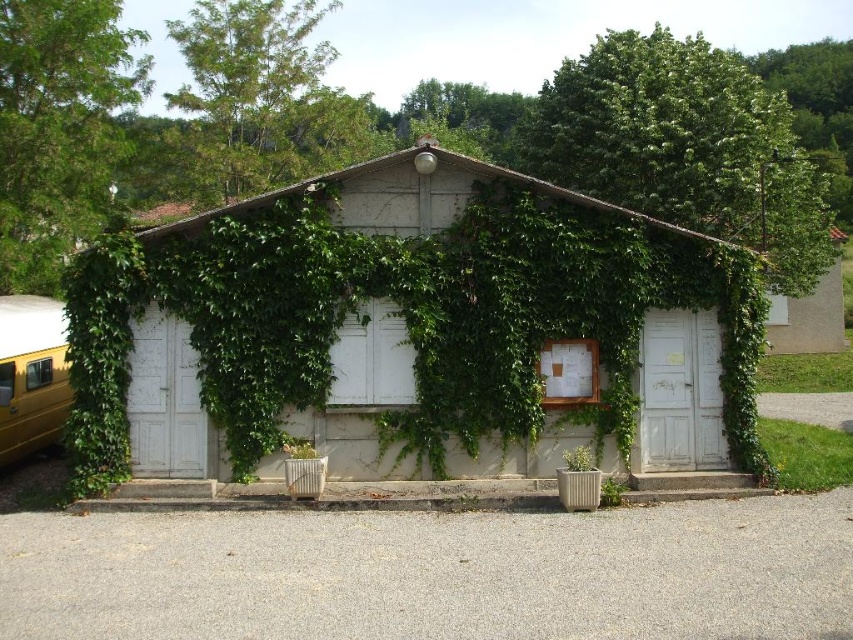
Question: Is green ivy-covered hut at center smaller than yellow matte school bus at left?

Choices:
 (A) no
 (B) yes

Answer: (B)

Question: Can you confirm if green ivy-covered hut at center is wider than yellow matte school bus at left?

Choices:
 (A) yes
 (B) no

Answer: (B)

Question: Observing the image, what is the correct spatial positioning of green ivy-covered hut at center in reference to yellow matte school bus at left?

Choices:
 (A) right
 (B) left

Answer: (A)

Question: Which point is closer to the camera?

Choices:
 (A) (109, 241)
 (B) (39, 308)

Answer: (A)